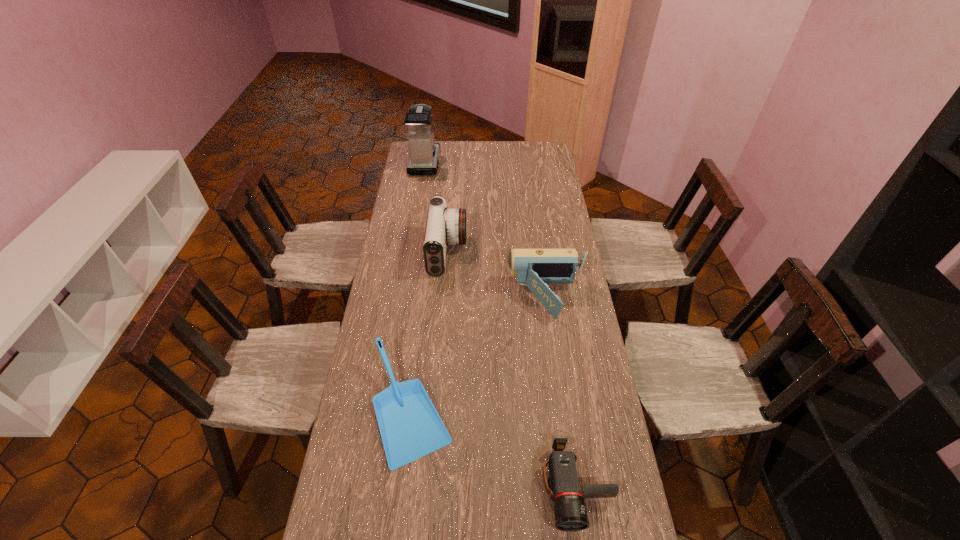
The width and height of the screenshot is (960, 540). I want to click on blank space located on the side of the second tallest camcorder with the flip-out screen, so click(445, 298).

I want to click on free space located 0.150m on the side of the second tallest camcorder with the flip-out screen, so click(468, 298).

I want to click on free location located on the side of the second tallest camcorder with the flip-out screen, so click(435, 298).

Locate an element on the screen. Image resolution: width=960 pixels, height=540 pixels. free space located 0.300m on the right of the second shortest object is located at coordinates (552, 408).

You are a GUI agent. You are given a task and a screenshot of the screen. Output one action in this format:
    pyautogui.click(x=<x>, y=<y>)
    Task: Click on the object that is at the far edge
    
    Given the screenshot: What is the action you would take?
    pyautogui.click(x=424, y=151)

The height and width of the screenshot is (540, 960). Identify the location of coffee maker that is at the left edge. (424, 151).

The height and width of the screenshot is (540, 960). I want to click on dustpan that is at the left edge, so click(410, 427).

Where is `object that is at the far left corner`? Image resolution: width=960 pixels, height=540 pixels. object that is at the far left corner is located at coordinates pyautogui.click(x=424, y=151).

Identify the location of vacant position at the far edge of the desktop. (487, 146).

Identify the location of vacant area at the left edge of the desktop. (396, 247).